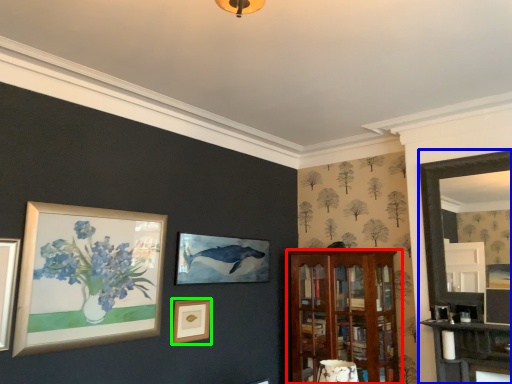
Question: Considering the real-world distances, which object is farthest from shelf (highlighted by a red box)? fireplace (highlighted by a blue box) or picture frame (highlighted by a green box)?

Choices:
 (A) fireplace
 (B) picture frame

Answer: (B)